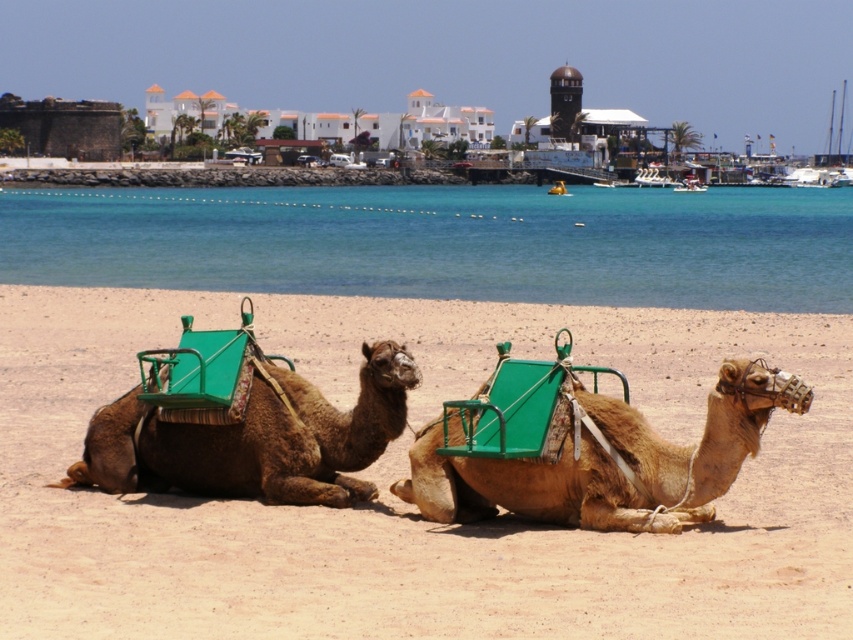
Question: Which object is farther from the camera taking this photo?

Choices:
 (A) green fabric camel seat at left
 (B) brown sandy beach at center
 (C) light brown leather camel at center
 (D) clear blue water at center

Answer: (D)

Question: Where is brown sandy beach at center located in relation to brown matte camel at left in the image?

Choices:
 (A) below
 (B) above

Answer: (B)

Question: Is brown sandy beach at center closer to the viewer compared to green fabric camel seat at left?

Choices:
 (A) no
 (B) yes

Answer: (B)

Question: Which object appears farthest from the camera in this image?

Choices:
 (A) brown sandy beach at center
 (B) brown matte camel at left
 (C) green fabric camel seat at left

Answer: (C)

Question: Which point appears farthest from the camera in this image?

Choices:
 (A) pos(741,417)
 (B) pos(320,419)
 (C) pos(225,557)
 (D) pos(378,237)

Answer: (D)

Question: Can you confirm if brown sandy beach at center is positioned to the left of light brown leather camel at center?

Choices:
 (A) yes
 (B) no

Answer: (A)